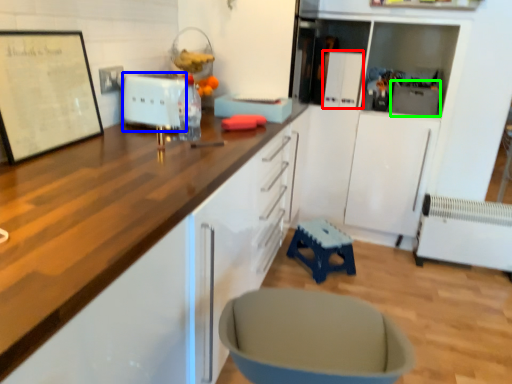
Question: Which object is positioned closest to appliance (highlighted by a red box)? Select from appliance (highlighted by a blue box) and appliance (highlighted by a green box).

Choices:
 (A) appliance
 (B) appliance

Answer: (B)